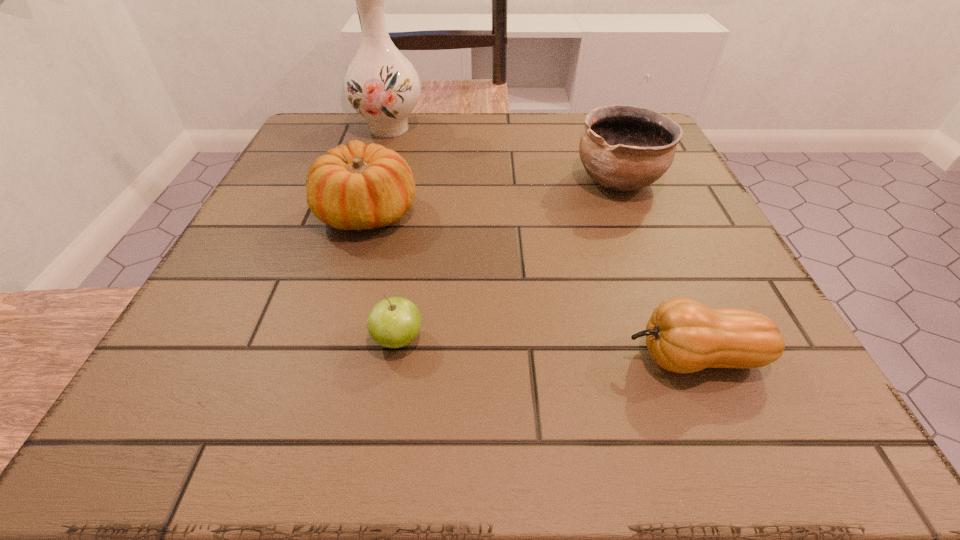
Find the location of a particular element. This screenshot has width=960, height=540. free spot that satisfies the following two spatial constraints: 1. on the back side of the apple; 2. on the right side of the pottery is located at coordinates (424, 180).

You are a GUI agent. You are given a task and a screenshot of the screen. Output one action in this format:
    pyautogui.click(x=<x>, y=<y>)
    Task: Click on the free region that satisfies the following two spatial constraints: 1. on the back side of the pottery; 2. on the left side of the left gourd
    
    Given the screenshot: What is the action you would take?
    pyautogui.click(x=377, y=180)